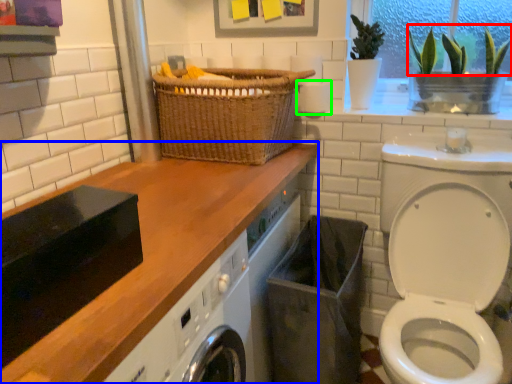
Question: Estimate the real-world distances between objects in this image. Which object is closer to plant (highlighted by a red box), countertop (highlighted by a blue box) or toilet paper (highlighted by a green box)?

Choices:
 (A) countertop
 (B) toilet paper

Answer: (B)